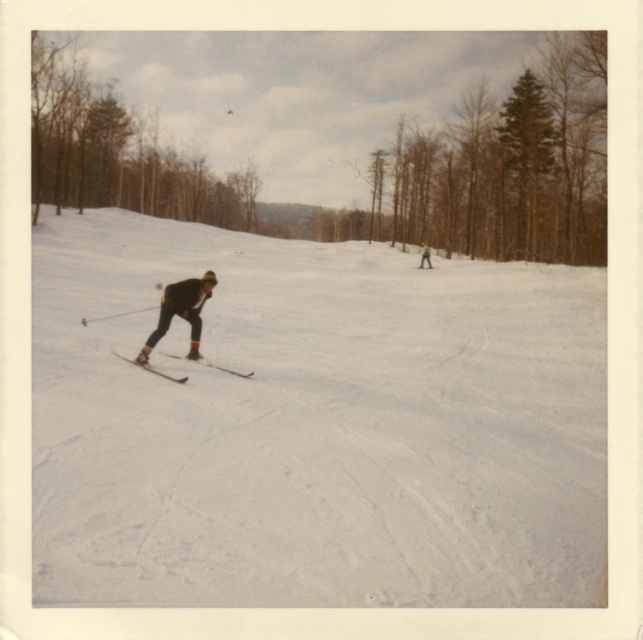
In the scene shown: Is dark brown leather skis at center above metallic silver skis at center?

Indeed, dark brown leather skis at center is positioned over metallic silver skis at center.

Between point (167, 317) and point (244, 378), which one is positioned in front?

Positioned in front is point (244, 378).

Find the location of a particular element. dark brown leather skis at center is located at coordinates (179, 312).

Is white matte snow at center to the left of brown wood tree at upper left from the viewer's perspective?

Incorrect, white matte snow at center is not on the left side of brown wood tree at upper left.

Is point (62, 348) in front of point (134, 205)?

That is True.

At what (x,y) coordinates should I click in order to perform the action: click on white matte snow at center. Please return your answer as a coordinate pair (x, y). Image resolution: width=643 pixels, height=640 pixels. Looking at the image, I should click on (314, 424).

Between metallic silver skis at center and matte black ski at center, which one is positioned higher?

matte black ski at center is above.

Is point (213, 365) more distant than point (147, 362)?

Yes, point (213, 365) is farther from viewer.

Does point (228, 371) come behind point (120, 356)?

No, (228, 371) is in front of (120, 356).

Find the location of `metallic silver skis at center`. metallic silver skis at center is located at coordinates (224, 369).